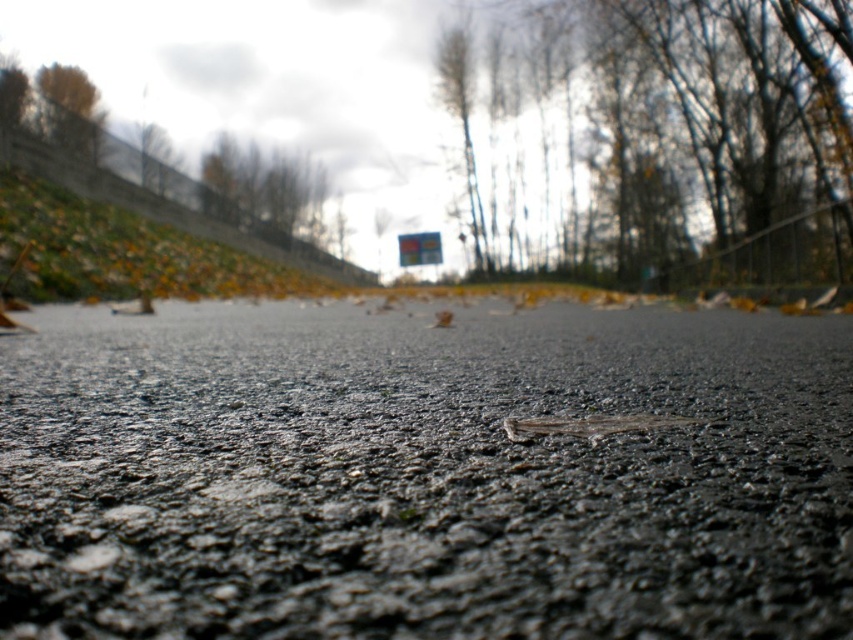
From the picture: Between black asphalt gravel at center and brown leafy tree at upper center, which one has less height?

black asphalt gravel at center

Which is more to the right, black asphalt gravel at center or brown leafy tree at upper center?

From the viewer's perspective, black asphalt gravel at center appears more on the right side.

This screenshot has width=853, height=640. Find the location of `black asphalt gravel at center`. black asphalt gravel at center is located at coordinates (424, 476).

Describe the element at coordinates (708, 125) in the screenshot. I see `bare branches at upper center` at that location.

Is point (659, 106) more distant than point (320, 234)?

No, it is not.

Between point (717, 152) and point (309, 188), which one is positioned behind?

The point (309, 188) is more distant.

Where is `bare branches at upper center`? This screenshot has height=640, width=853. bare branches at upper center is located at coordinates (708, 125).

The height and width of the screenshot is (640, 853). What do you see at coordinates (424, 476) in the screenshot?
I see `black asphalt gravel at center` at bounding box center [424, 476].

At what (x,y) coordinates should I click in order to perform the action: click on black asphalt gravel at center. Please return your answer as a coordinate pair (x, y). Image resolution: width=853 pixels, height=640 pixels. Looking at the image, I should click on (424, 476).